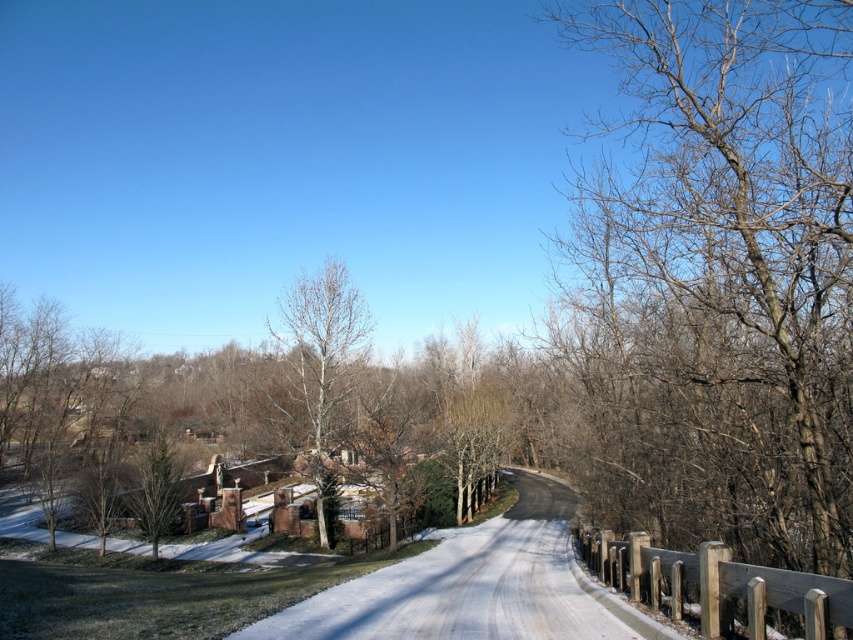
You are a photographer wanting to capture a photo of the bare branches at right and the bare wood tree at center. Which object is located above the other in the image?

The bare branches at right is positioned over the bare wood tree at center in the image.

You are standing at the starting point of the road and want to reach a specific location. There are two points marked on the road. The first point is at coordinates point (677, 508), and the second point is at coordinates point (328, 516). Which point is closer to your current position?

Point (677, 508) is in front of point (328, 516), so it is closer to your current position at the starting point of the road.